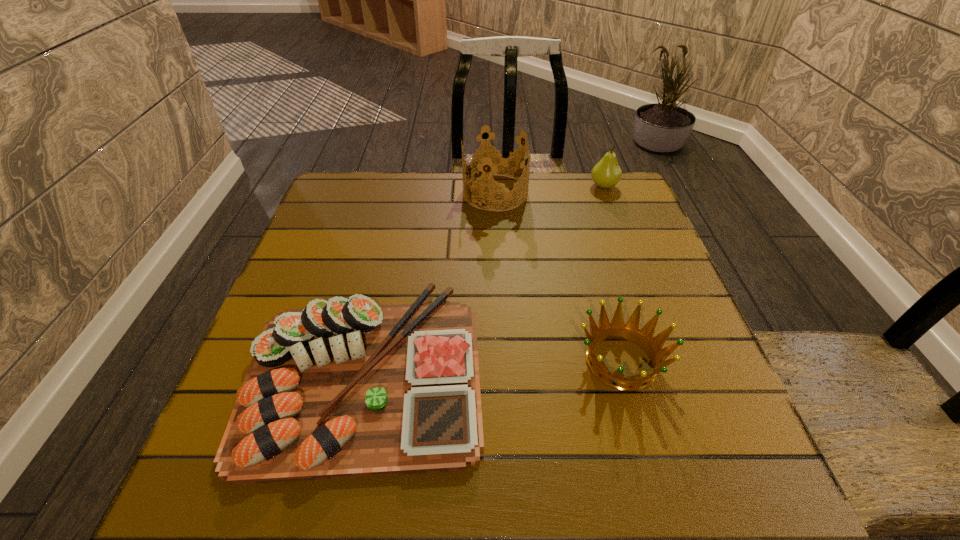
You are a GUI agent. You are given a task and a screenshot of the screen. Output one action in this format:
    pyautogui.click(x=<x>, y=<y>)
    Task: Click on the farther crown
    This screenshot has width=960, height=540.
    Given the screenshot: What is the action you would take?
    pyautogui.click(x=496, y=159)

What are the coordinates of `the left crown` in the screenshot? It's located at [496, 159].

Where is `pear`? This screenshot has width=960, height=540. pear is located at coordinates (606, 173).

At what (x,y) coordinates should I click in order to perform the action: click on the right crown. Please return your answer as a coordinate pair (x, y). The height and width of the screenshot is (540, 960). Looking at the image, I should click on (631, 331).

I want to click on the nearer crown, so click(x=631, y=331).

The width and height of the screenshot is (960, 540). Identify the location of platter. (344, 388).

Image resolution: width=960 pixels, height=540 pixels. What are the coordinates of `free location located 0.190m on the front of the left crown` in the screenshot? It's located at (498, 258).

The width and height of the screenshot is (960, 540). What are the coordinates of `free space located on the left of the third shortest object` in the screenshot? It's located at (479, 186).

The image size is (960, 540). I want to click on vacant space situated on the back of the shorter crown, so click(584, 225).

Identify the location of vacant space located 0.070m on the back of the platter. The height and width of the screenshot is (540, 960). (386, 270).